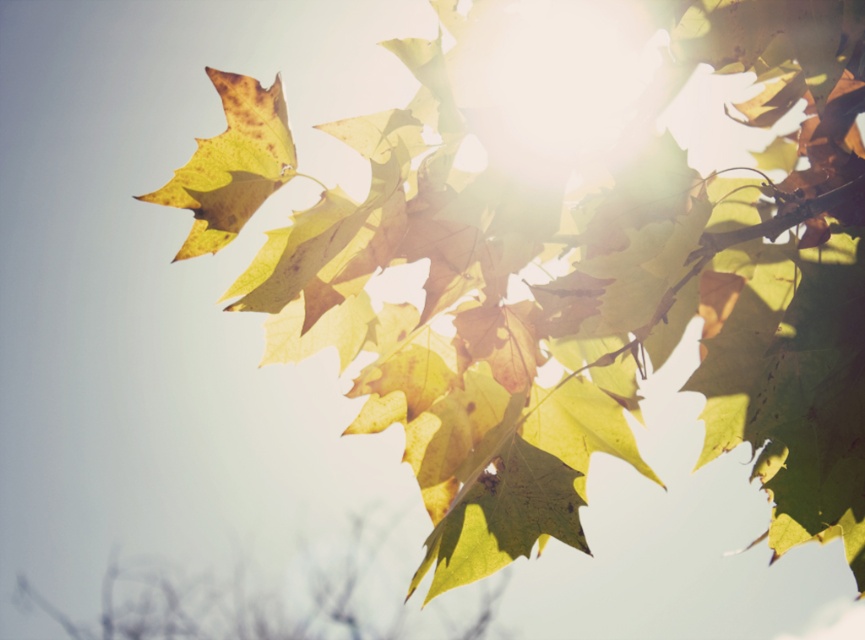
Is yellow-green matte leaf at center wider than yellow-green matte leaf at upper left?

Yes, yellow-green matte leaf at center is wider than yellow-green matte leaf at upper left.

How far apart are yellow-green matte leaf at center and yellow-green matte leaf at upper left?

13.33 inches

Does point (516, 474) come behind point (216, 164)?

Yes, point (516, 474) is farther from viewer.

Where is `yellow-green matte leaf at center`? This screenshot has width=865, height=640. yellow-green matte leaf at center is located at coordinates (507, 515).